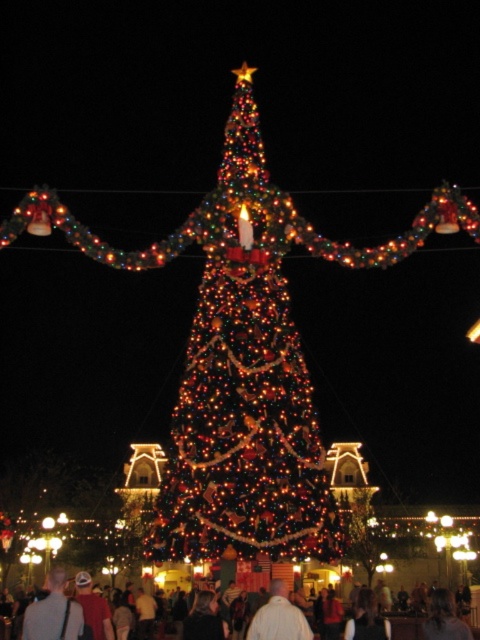
Is dark brown leather jacket at lower right below white cotton shirt at center?

Incorrect, dark brown leather jacket at lower right is not positioned below white cotton shirt at center.

Does dark brown leather jacket at lower right appear on the right side of white cotton shirt at center?

Correct, you'll find dark brown leather jacket at lower right to the right of white cotton shirt at center.

Locate an element on the screen. This screenshot has width=480, height=640. dark brown leather jacket at lower right is located at coordinates (444, 618).

Which is in front, point (359, 628) or point (472, 636)?

Point (359, 628)

Is point (367, 604) positioned before point (403, 625)?

Yes, point (367, 604) is in front of point (403, 625).

Which is in front, point (364, 620) or point (408, 625)?

Point (364, 620) is in front.

Locate an element on the screen. dark gray sweater at lower center is located at coordinates (367, 620).

Between white matte shirt at center and dark gray sweater at lower center, which one appears on the right side from the viewer's perspective?

Positioned to the right is dark gray sweater at lower center.

How much distance is there between white matte shirt at center and dark gray sweater at lower center?

The distance of white matte shirt at center from dark gray sweater at lower center is 10.23 meters.

Is point (254, 632) farther from camera compared to point (363, 596)?

No, it is in front of (363, 596).

Where is `white matte shirt at center`? white matte shirt at center is located at coordinates (278, 618).